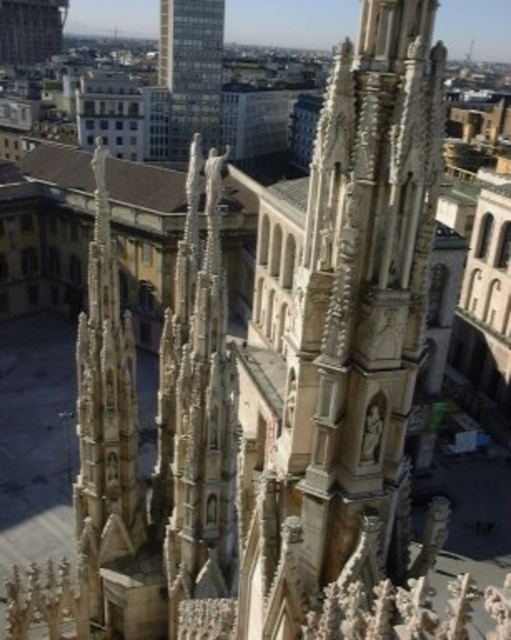
Is point (218, 33) farther from viewer compared to point (35, 19)?

That is False.

Can you confirm if smooth glass skyscraper at upper center is thinner than smooth brown tower at upper left?

Yes.

This screenshot has width=511, height=640. What are the coordinates of `smooth glass skyscraper at upper center` in the screenshot? It's located at (192, 68).